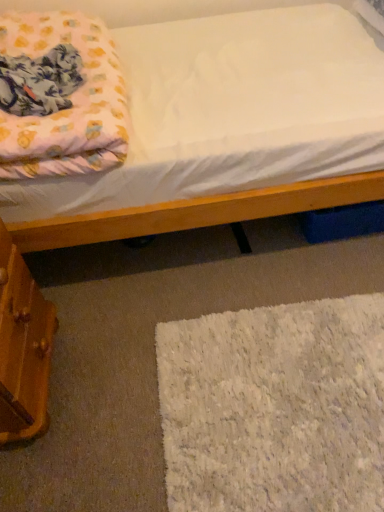
I want to click on vacant space in between wooden drawer at lower left and white fluffy rug at lower right, so click(x=118, y=387).